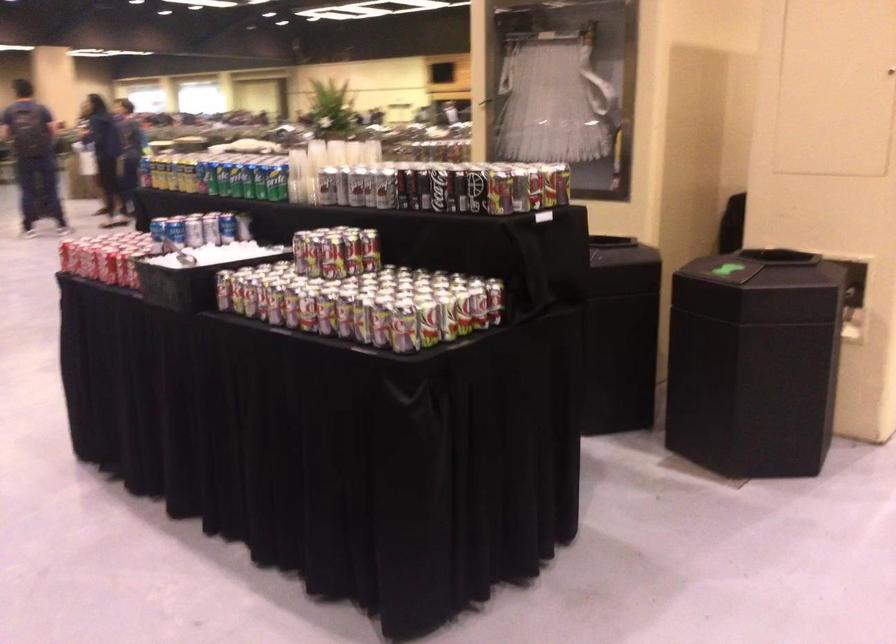
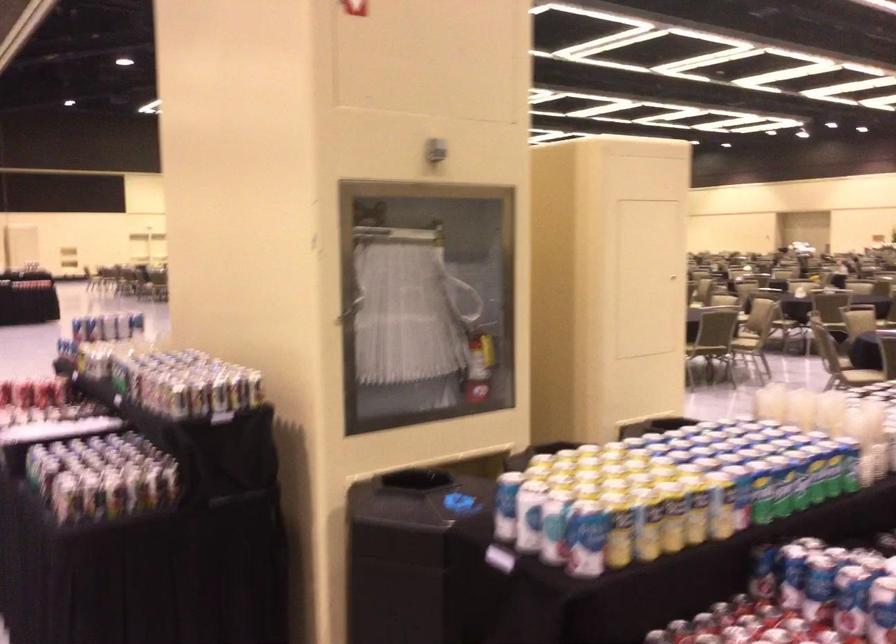
Find the pixel in the second image that matches (176,164) in the first image.

(695, 509)